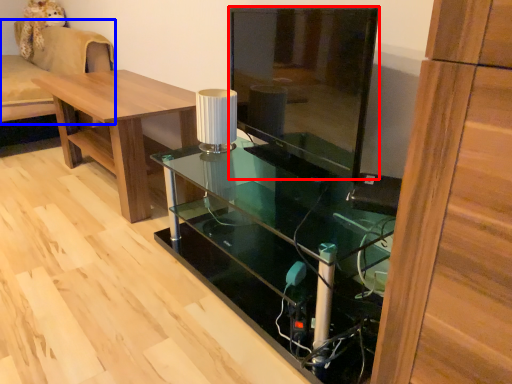
Question: Which of the following is the farthest to the observer, glass door (highlighted by a red box) or couch (highlighted by a blue box)?

Choices:
 (A) glass door
 (B) couch

Answer: (B)